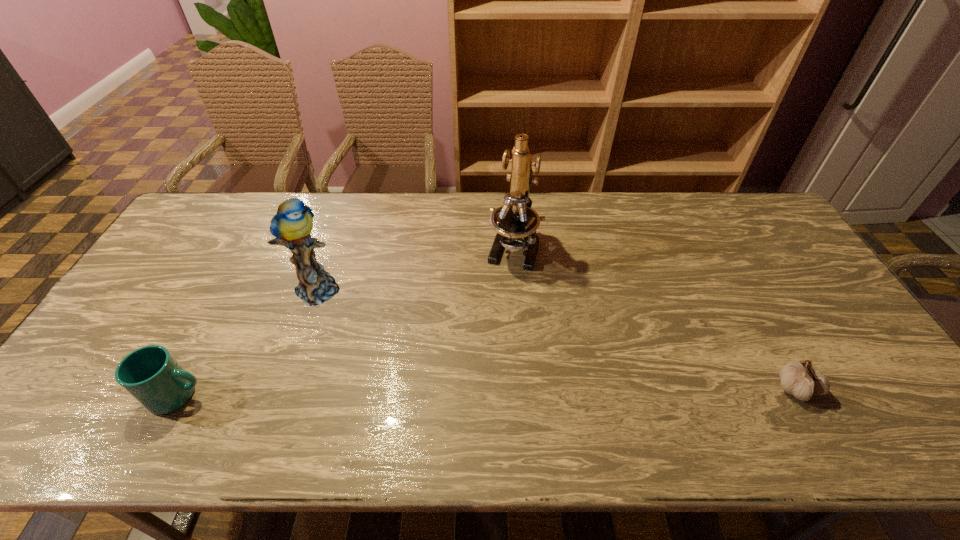
At what (x,y) coordinates should I click in order to perform the action: click on the leftmost object. Please return your answer as a coordinate pair (x, y). Looking at the image, I should click on (151, 375).

At what (x,y) coordinates should I click in order to perform the action: click on the rightmost object. Please return your answer as a coordinate pair (x, y). Looking at the image, I should click on (800, 379).

Locate an element on the screen. the second object from right to left is located at coordinates (515, 222).

This screenshot has width=960, height=540. I want to click on the second object from left to right, so click(292, 224).

Find the location of `the second tallest object`. the second tallest object is located at coordinates (292, 224).

I want to click on blank space located on the handle side of the cup, so [288, 395].

Find the location of `vacant space located on the left of the garlic`. vacant space located on the left of the garlic is located at coordinates (611, 388).

This screenshot has width=960, height=540. In order to click on vacant space located at the eyepiece of the third object from left to right in this screenshot , I will do `click(501, 297)`.

I want to click on blank space located 0.280m at the eyepiece of the third object from left to right, so click(487, 347).

Where is `vacant point located at the eyepiece of the third object from left to right`? This screenshot has width=960, height=540. vacant point located at the eyepiece of the third object from left to right is located at coordinates (492, 326).